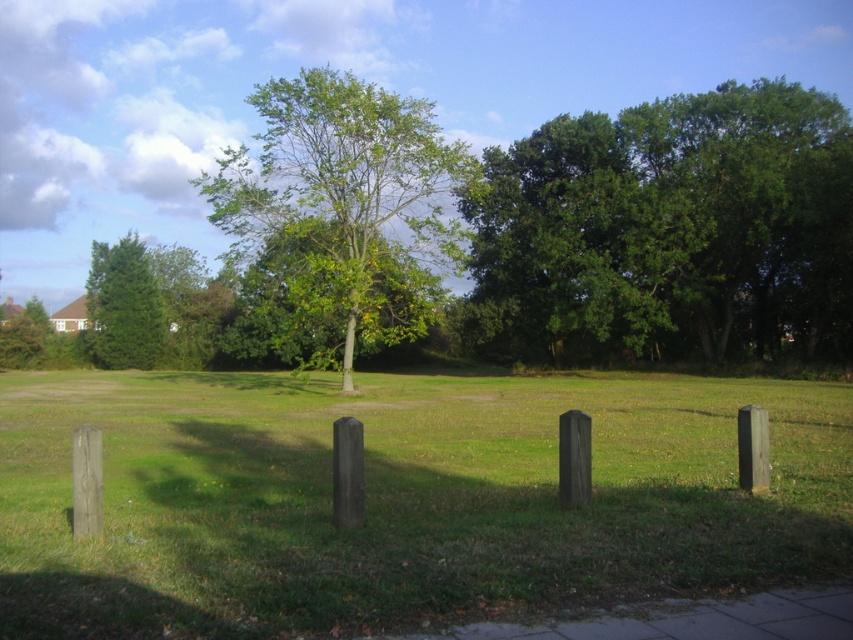
Question: Is green leafy tree at upper right below green leafy tree at center?

Choices:
 (A) yes
 (B) no

Answer: (A)

Question: Is wooden posts at center above green matte tree at left?

Choices:
 (A) no
 (B) yes

Answer: (A)

Question: Estimate the real-world distances between objects in this image. Which object is farther from the green matte tree at left?

Choices:
 (A) green leafy tree at upper right
 (B) wooden posts at center

Answer: (B)

Question: Which point is farther to the camera?

Choices:
 (A) coord(103,246)
 (B) coord(358,248)
 (C) coord(618,129)

Answer: (A)

Question: Which point is farther to the camera?

Choices:
 (A) green matte tree at left
 (B) green leafy tree at center

Answer: (A)

Question: Does green leafy tree at center have a larger size compared to green matte tree at left?

Choices:
 (A) no
 (B) yes

Answer: (B)